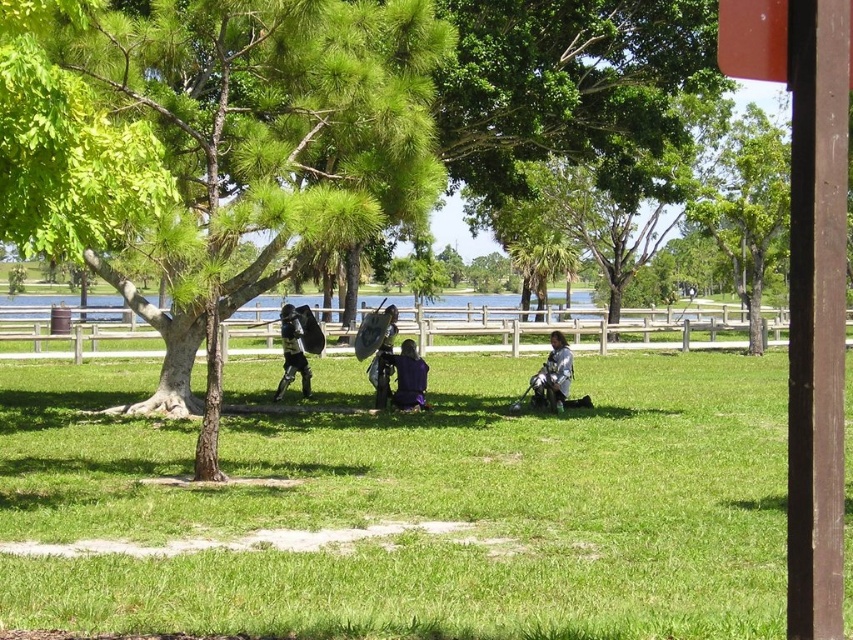
Identify the location of purple fabric backpack at center. This screenshot has width=853, height=640. (x=402, y=378).

Is purple fabric backpack at center thinner than black matte armor at center?

No.

The image size is (853, 640). What are the coordinates of `purple fabric backpack at center` in the screenshot? It's located at (402, 378).

Which is above, green grass at center or shiny silver armor at center?

shiny silver armor at center is above.

Does point (300, 518) come in front of point (564, 394)?

Yes, point (300, 518) is closer to viewer.

Is point (192, 621) behind point (558, 372)?

No, it is not.

Locate an element on the screen. green grass at center is located at coordinates (419, 506).

Based on the photo, does green leafy tree at center have a lesser width compared to purple fabric backpack at center?

No.

Based on the photo, can you confirm if green leafy tree at center is positioned to the right of purple fabric backpack at center?

Incorrect, green leafy tree at center is not on the right side of purple fabric backpack at center.

What do you see at coordinates (212, 147) in the screenshot? I see `green leafy tree at center` at bounding box center [212, 147].

You are a GUI agent. You are given a task and a screenshot of the screen. Output one action in this format:
    pyautogui.click(x=<x>, y=<y>)
    Task: Click on the green leafy tree at center
    
    Given the screenshot: What is the action you would take?
    pyautogui.click(x=212, y=147)